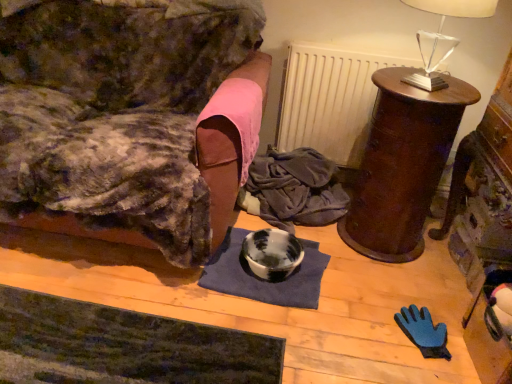
Question: Is dark green textured yoga mat at lower left wider than marbled ceramic bowl at center?

Choices:
 (A) yes
 (B) no

Answer: (A)

Question: Is dark green textured yoga mat at lower left in front of marbled ceramic bowl at center?

Choices:
 (A) yes
 (B) no

Answer: (A)

Question: Is dark green textured yoga mat at lower left thinner than marbled ceramic bowl at center?

Choices:
 (A) yes
 (B) no

Answer: (B)

Question: Does dark green textured yoga mat at lower left have a lesser height compared to marbled ceramic bowl at center?

Choices:
 (A) yes
 (B) no

Answer: (A)

Question: Is dark green textured yoga mat at lower left facing towards marbled ceramic bowl at center?

Choices:
 (A) yes
 (B) no

Answer: (B)

Question: From the image's perspective, is dark green textured yoga mat at lower left below marbled ceramic bowl at center?

Choices:
 (A) no
 (B) yes

Answer: (B)

Question: Is the position of white matte radiator at upper center less distant than that of dark blue fabric at center?

Choices:
 (A) yes
 (B) no

Answer: (A)

Question: Can you confirm if white matte radiator at upper center is smaller than dark blue fabric at center?

Choices:
 (A) no
 (B) yes

Answer: (A)

Question: Does white matte radiator at upper center have a lesser height compared to dark blue fabric at center?

Choices:
 (A) no
 (B) yes

Answer: (A)

Question: From the image's perspective, is white matte radiator at upper center beneath dark blue fabric at center?

Choices:
 (A) yes
 (B) no

Answer: (B)

Question: Would you say white matte radiator at upper center is a long distance from dark blue fabric at center?

Choices:
 (A) no
 (B) yes

Answer: (A)

Question: From a real-world perspective, is white matte radiator at upper center below dark blue fabric at center?

Choices:
 (A) yes
 (B) no

Answer: (B)

Question: Does blue fabric mat at center have a greater height compared to velvet couch at left, placed as the 2th furniture when sorted from right to left?

Choices:
 (A) no
 (B) yes

Answer: (A)